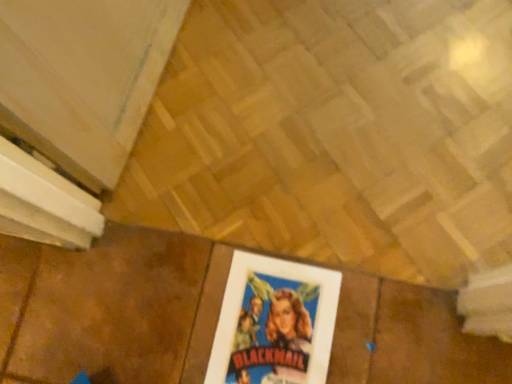
Locate an element on the screen. This screenshot has width=512, height=384. white matte picture frame at lower center is located at coordinates (274, 323).

Image resolution: width=512 pixels, height=384 pixels. Describe the element at coordinates (274, 323) in the screenshot. I see `white matte picture frame at lower center` at that location.

Identify the location of white matte picture frame at lower center. (274, 323).